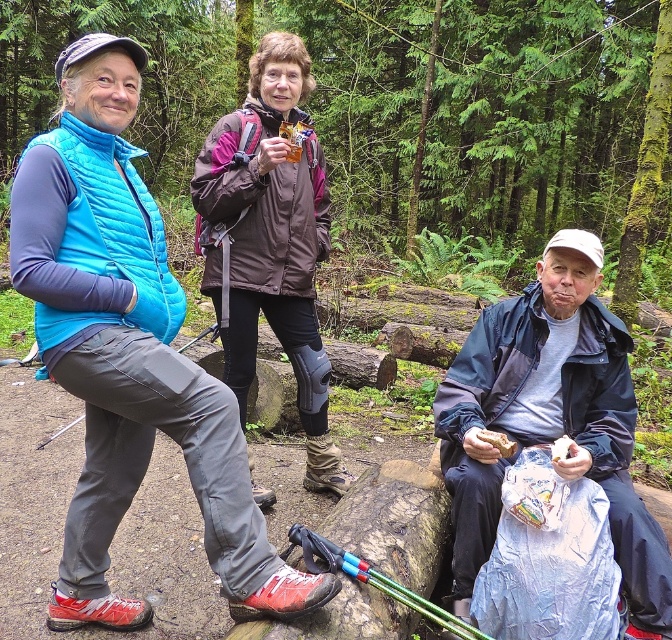
Is matte blue vest at left positioned in front of dark blue jacket at lower right?

Yes, it is in front of dark blue jacket at lower right.

Between matte blue vest at left and dark blue jacket at lower right, which one is positioned lower?

dark blue jacket at lower right is below.

Is point (95, 531) closer to camera compared to point (491, 490)?

No, it is not.

You are a GUI agent. You are given a task and a screenshot of the screen. Output one action in this format:
    pyautogui.click(x=<x>, y=<y>)
    Task: Click on the matte blue vest at left
    The width and height of the screenshot is (672, 640).
    Given the screenshot: What is the action you would take?
    pyautogui.click(x=128, y=352)

Does dark blue jacket at lower right appear over brown/mesh knee brace at center?

No, dark blue jacket at lower right is not above brown/mesh knee brace at center.

Who is more forward, (554, 234) or (243, 417)?

Point (243, 417)

Describe the element at coordinates (550, 420) in the screenshot. I see `dark blue jacket at lower right` at that location.

In order to click on dark blue jacket at lower right in this screenshot , I will do `click(550, 420)`.

Who is taller, brown/mesh knee brace at center or matte brown sandwich at lower center?

brown/mesh knee brace at center is taller.

Does brown/mesh knee brace at center appear on the left side of matte brown sandwich at lower center?

Yes, brown/mesh knee brace at center is to the left of matte brown sandwich at lower center.

What are the coordinates of `brown/mesh knee brace at center` in the screenshot? It's located at (269, 240).